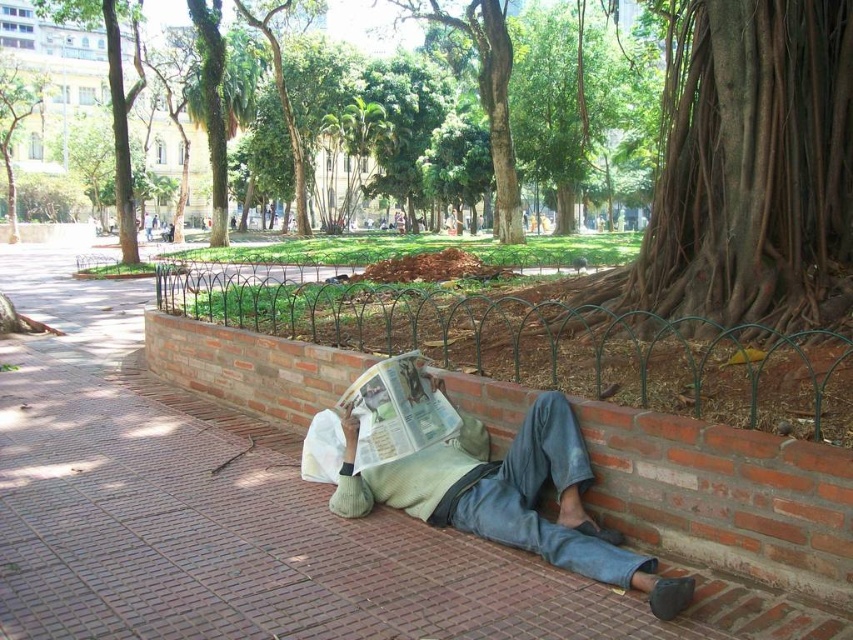
Does green leafy tree at upper center appear over light green sweater at lower center?

Yes, green leafy tree at upper center is above light green sweater at lower center.

Is green leafy tree at upper center below light green sweater at lower center?

Actually, green leafy tree at upper center is above light green sweater at lower center.

Identify the location of green leafy tree at upper center. (386, 129).

This screenshot has width=853, height=640. Find the location of `green leafy tree at upper center`. green leafy tree at upper center is located at coordinates (386, 129).

How distant is brown rough bark at upper right from light green sweater at lower center?

They are 2.57 meters apart.

This screenshot has width=853, height=640. I want to click on brown rough bark at upper right, so click(x=747, y=170).

Which is more to the left, brown rough bark at upper right or green leafy tree at upper center?

green leafy tree at upper center is more to the left.

Can you confirm if brown rough bark at upper right is thinner than green leafy tree at upper center?

Correct, brown rough bark at upper right's width is less than green leafy tree at upper center's.

Which is in front, point (804, 156) or point (440, 180)?

Point (804, 156) is more forward.

Where is `brown rough bark at upper right`? Image resolution: width=853 pixels, height=640 pixels. brown rough bark at upper right is located at coordinates (747, 170).